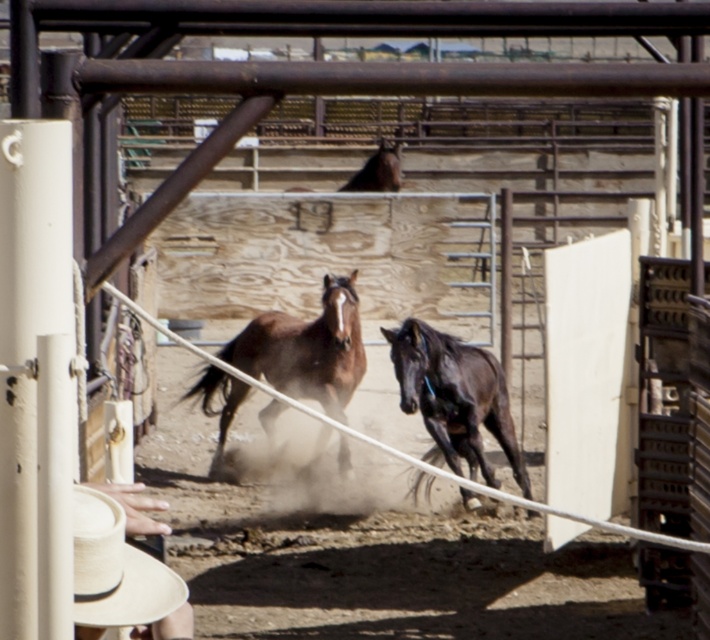
Question: Estimate the real-world distances between objects in this image. Which object is closer to the brown glossy horse at center?

Choices:
 (A) shiny black horse at center
 (B) brown glossy horse at upper center

Answer: (A)

Question: Which point appears farthest from the camera in this image?

Choices:
 (A) (432, 433)
 (B) (89, 493)
 (C) (368, 157)

Answer: (C)

Question: Can you confirm if brown glossy horse at center is smaller than brown glossy horse at upper center?

Choices:
 (A) no
 (B) yes

Answer: (A)

Question: Does shiny black horse at center lie in front of brown glossy horse at upper center?

Choices:
 (A) yes
 (B) no

Answer: (A)

Question: Is the position of natural straw cowboy hat at lower left more distant than that of brown glossy horse at upper center?

Choices:
 (A) yes
 (B) no

Answer: (B)

Question: Estimate the real-world distances between objects in this image. Which object is closer to the brown glossy horse at center?

Choices:
 (A) shiny black horse at center
 (B) natural straw cowboy hat at lower left
 (C) brown glossy horse at upper center

Answer: (A)